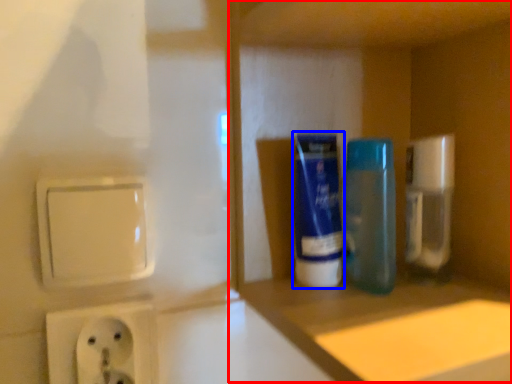
Question: Which object appears closest to the camera in this image, cabinet (highlighted by a red box) or mouthwash (highlighted by a blue box)?

Choices:
 (A) cabinet
 (B) mouthwash

Answer: (A)